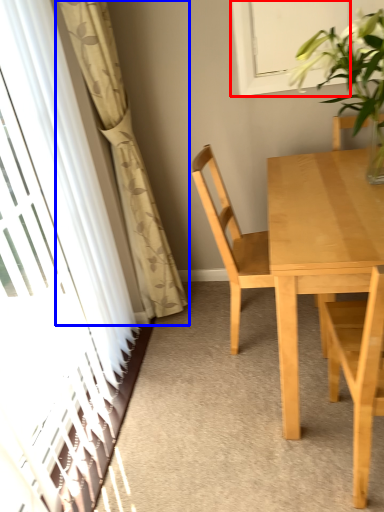
Question: Which object appears closest to the camera in this image, window (highlighted by a red box) or curtain (highlighted by a blue box)?

Choices:
 (A) window
 (B) curtain

Answer: (B)